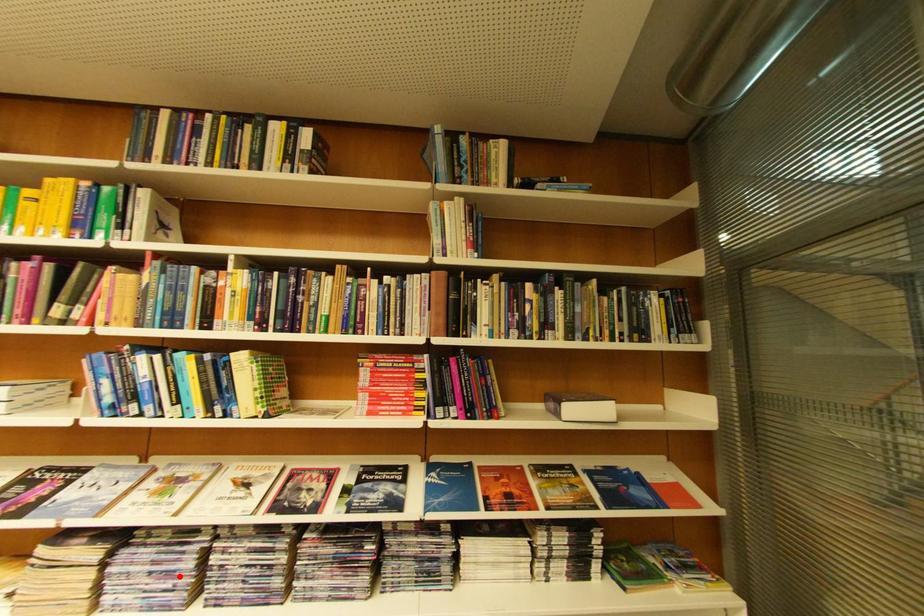
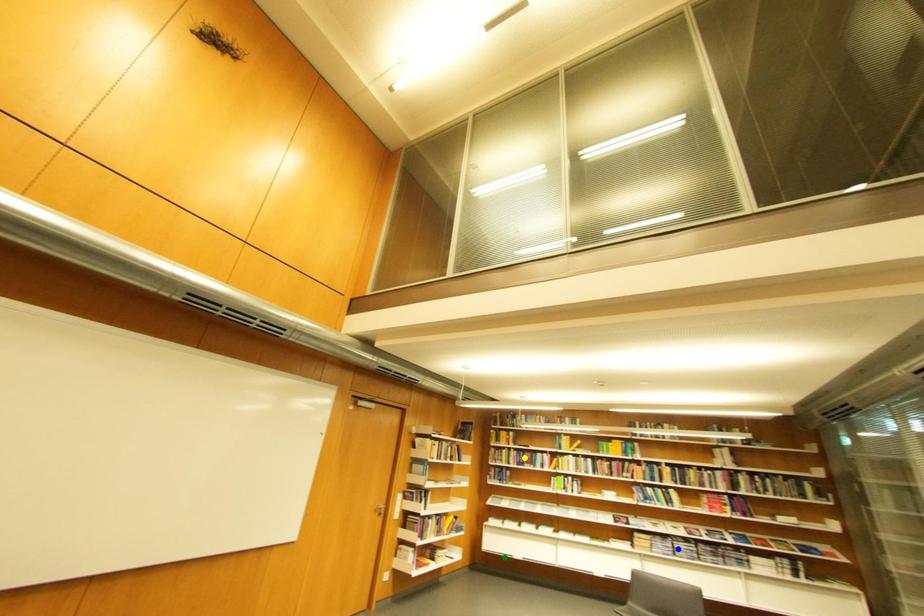
Question: I am providing you with two images of the same scene from different viewpoints. A red point is marked on the first image. You are given multiple points on the second image. In image 2, which mark is for the same physical point as the one in image 1?

Choices:
 (A) blue point
 (B) yellow point
 (C) green point

Answer: (A)